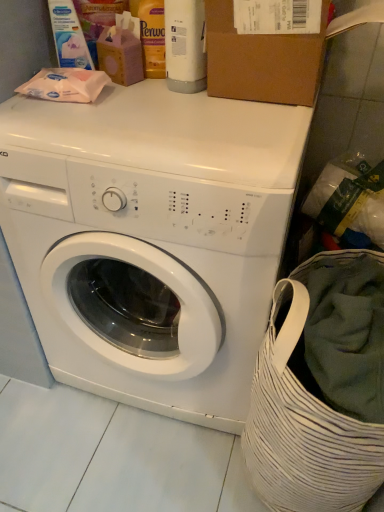
You are a GUI agent. You are given a task and a screenshot of the screen. Output one action in this format:
    pyautogui.click(x=<x>, y=<y>)
    Task: Click on the brown cardboard box at upper center
    This screenshot has height=512, width=384.
    Given the screenshot: What is the action you would take?
    pyautogui.click(x=262, y=60)

I want to click on matte white wipes at upper left, the first cleaning product viewed from the left, so click(x=69, y=36).

This screenshot has height=512, width=384. I want to click on white striped fabric laundry basket at lower right, so click(x=306, y=419).

Does brown cardboard box at upper center have a lesser height compared to white glossy bottle at upper center, acting as the second cleaning product starting from the left?

Indeed, brown cardboard box at upper center has a lesser height compared to white glossy bottle at upper center, acting as the second cleaning product starting from the left.

Between brown cardboard box at upper center and white glossy bottle at upper center, acting as the second cleaning product starting from the left, which one appears on the left side from the viewer's perspective?

Positioned to the left is white glossy bottle at upper center, acting as the second cleaning product starting from the left.

Can you confirm if brown cardboard box at upper center is smaller than white glossy bottle at upper center, acting as the 1th cleaning product starting from the right?

Incorrect, brown cardboard box at upper center is not smaller in size than white glossy bottle at upper center, acting as the 1th cleaning product starting from the right.

Is brown cardboard box at upper center shorter than white matte washing machine at center?

Correct, brown cardboard box at upper center is not as tall as white matte washing machine at center.

Is brown cardboard box at upper center positioned beyond the bounds of white matte washing machine at center?

Yes, brown cardboard box at upper center is located beyond the bounds of white matte washing machine at center.

Considering the relative sizes of brown cardboard box at upper center and white matte washing machine at center in the image provided, is brown cardboard box at upper center bigger than white matte washing machine at center?

No.

Consider the image. From the image's perspective, is matte white wipes at upper left, which is counted as the second cleaning product, starting from the right, located above or below white striped fabric laundry basket at lower right?

matte white wipes at upper left, which is counted as the second cleaning product, starting from the right, is above white striped fabric laundry basket at lower right.

From a real-world perspective, which object stands above the other?

matte white wipes at upper left, the first cleaning product viewed from the left, is physically above.

What's the angular difference between matte white wipes at upper left, which is counted as the second cleaning product, starting from the right, and white striped fabric laundry basket at lower right's facing directions?

The facing directions of matte white wipes at upper left, which is counted as the second cleaning product, starting from the right, and white striped fabric laundry basket at lower right are 1.53 degrees apart.

From a real-world perspective, count 1st cleaning products upward from the white striped fabric laundry basket at lower right and point to it. Please provide its 2D coordinates.

[(69, 36)]

Is white matte washing machine at center next to white striped fabric laundry basket at lower right?

No, white matte washing machine at center is not beside white striped fabric laundry basket at lower right.

Is white matte washing machine at center oriented away from white striped fabric laundry basket at lower right?

white matte washing machine at center does not have its back to white striped fabric laundry basket at lower right.

Between white matte washing machine at center and white striped fabric laundry basket at lower right, which one has less height?

white striped fabric laundry basket at lower right.

In the scene shown: Is white glossy bottle at upper center, acting as the 1th cleaning product starting from the right, with matte white wipes at upper left, which is counted as the second cleaning product, starting from the right?

No, white glossy bottle at upper center, acting as the 1th cleaning product starting from the right, is not making contact with matte white wipes at upper left, which is counted as the second cleaning product, starting from the right.

This screenshot has width=384, height=512. In the image, there is a white glossy bottle at upper center, acting as the 1th cleaning product starting from the right. In order to click on cleaning product above it (from the image's perspective) in this screenshot , I will do `click(69, 36)`.

Does point (175, 51) lie behind point (58, 0)?

No, (175, 51) is closer to viewer.

Does white glossy bottle at upper center, acting as the 1th cleaning product starting from the right, turn towards matte white wipes at upper left, the first cleaning product viewed from the left?

No, white glossy bottle at upper center, acting as the 1th cleaning product starting from the right, is not turned towards matte white wipes at upper left, the first cleaning product viewed from the left.

Considering the sizes of objects white matte washing machine at center and white glossy bottle at upper center, acting as the 1th cleaning product starting from the right, in the image provided, who is wider, white matte washing machine at center or white glossy bottle at upper center, acting as the 1th cleaning product starting from the right,?

With larger width is white matte washing machine at center.

Considering the points (119, 89) and (173, 50), which point is in front, point (119, 89) or point (173, 50)?

Point (173, 50)

Considering the sizes of white matte washing machine at center and white glossy bottle at upper center, acting as the 1th cleaning product starting from the right, in the image, is white matte washing machine at center taller or shorter than white glossy bottle at upper center, acting as the 1th cleaning product starting from the right,?

white matte washing machine at center is taller than white glossy bottle at upper center, acting as the 1th cleaning product starting from the right.

From the picture: From the image's perspective, is white matte washing machine at center positioned above or below white glossy bottle at upper center, acting as the second cleaning product starting from the left?

white matte washing machine at center is situated lower than white glossy bottle at upper center, acting as the second cleaning product starting from the left, in the image.

Is white matte washing machine at center looking in the opposite direction of matte white wipes at upper left, which is counted as the second cleaning product, starting from the right?

That's not correct — white matte washing machine at center is not looking away from matte white wipes at upper left, which is counted as the second cleaning product, starting from the right.

Relative to matte white wipes at upper left, the first cleaning product viewed from the left, is white matte washing machine at center in front or behind?

white matte washing machine at center is positioned closer to the viewer than matte white wipes at upper left, the first cleaning product viewed from the left.

Find the location of a particular element. the 1st cleaning product located above the white matte washing machine at center (from a real-world perspective) is located at coordinates (69, 36).

Which of these two, white matte washing machine at center or matte white wipes at upper left, the first cleaning product viewed from the left, stands shorter?

Standing shorter between the two is matte white wipes at upper left, the first cleaning product viewed from the left.

I want to click on the 1st cleaning product to the left when counting from the brown cardboard box at upper center, so click(x=185, y=45).

What are the coordinates of `washing machine beneath the brown cardboard box at upper center (from a real-world perspective)` in the screenshot? It's located at (154, 232).

Looking at this image, when comparing their distances from brown cardboard box at upper center, does white glossy bottle at upper center, acting as the second cleaning product starting from the left, or white matte washing machine at center seem further?

white matte washing machine at center.

Looking at the image, which one is located closer to white striped fabric laundry basket at lower right, white matte washing machine at center or white glossy bottle at upper center, acting as the 1th cleaning product starting from the right?

white matte washing machine at center is positioned closer to the anchor white striped fabric laundry basket at lower right.

From the image, which object appears to be nearer to matte white wipes at upper left, which is counted as the second cleaning product, starting from the right, white matte washing machine at center or white glossy bottle at upper center, acting as the second cleaning product starting from the left?

white glossy bottle at upper center, acting as the second cleaning product starting from the left, is positioned closer to the anchor matte white wipes at upper left, which is counted as the second cleaning product, starting from the right.

When comparing their distances from white glossy bottle at upper center, acting as the second cleaning product starting from the left, does white matte washing machine at center or matte white wipes at upper left, the first cleaning product viewed from the left, seem closer?

Based on the image, matte white wipes at upper left, the first cleaning product viewed from the left, appears to be nearer to white glossy bottle at upper center, acting as the second cleaning product starting from the left.

From the image, which object appears to be farther from white glossy bottle at upper center, acting as the 1th cleaning product starting from the right, white striped fabric laundry basket at lower right or matte white wipes at upper left, the first cleaning product viewed from the left?

Based on the image, white striped fabric laundry basket at lower right appears to be further to white glossy bottle at upper center, acting as the 1th cleaning product starting from the right.

When comparing their distances from white glossy bottle at upper center, acting as the 1th cleaning product starting from the right, does matte white wipes at upper left, the first cleaning product viewed from the left, or white striped fabric laundry basket at lower right seem closer?

The object closer to white glossy bottle at upper center, acting as the 1th cleaning product starting from the right, is matte white wipes at upper left, the first cleaning product viewed from the left.

Considering their positions, is matte white wipes at upper left, which is counted as the second cleaning product, starting from the right, positioned closer to white glossy bottle at upper center, acting as the 1th cleaning product starting from the right, than brown cardboard box at upper center?

Among the two, brown cardboard box at upper center is located nearer to white glossy bottle at upper center, acting as the 1th cleaning product starting from the right.

Looking at this image, when comparing their distances from white striped fabric laundry basket at lower right, does white glossy bottle at upper center, acting as the 1th cleaning product starting from the right, or brown cardboard box at upper center seem further?

white glossy bottle at upper center, acting as the 1th cleaning product starting from the right, is positioned further to the anchor white striped fabric laundry basket at lower right.

The width and height of the screenshot is (384, 512). In order to click on washing machine between matte white wipes at upper left, which is counted as the second cleaning product, starting from the right, and white striped fabric laundry basket at lower right, in the vertical direction in this screenshot , I will do tap(154, 232).

Image resolution: width=384 pixels, height=512 pixels. In order to click on washing machine between brown cardboard box at upper center and white striped fabric laundry basket at lower right vertically in this screenshot , I will do `click(154, 232)`.

I want to click on cleaning product between matte white wipes at upper left, which is counted as the second cleaning product, starting from the right, and white striped fabric laundry basket at lower right from top to bottom, so click(185, 45).

Where is `cardboard box that lies between matte white wipes at upper left, which is counted as the second cleaning product, starting from the right, and white matte washing machine at center from top to bottom`? The width and height of the screenshot is (384, 512). cardboard box that lies between matte white wipes at upper left, which is counted as the second cleaning product, starting from the right, and white matte washing machine at center from top to bottom is located at coordinates pos(262,60).